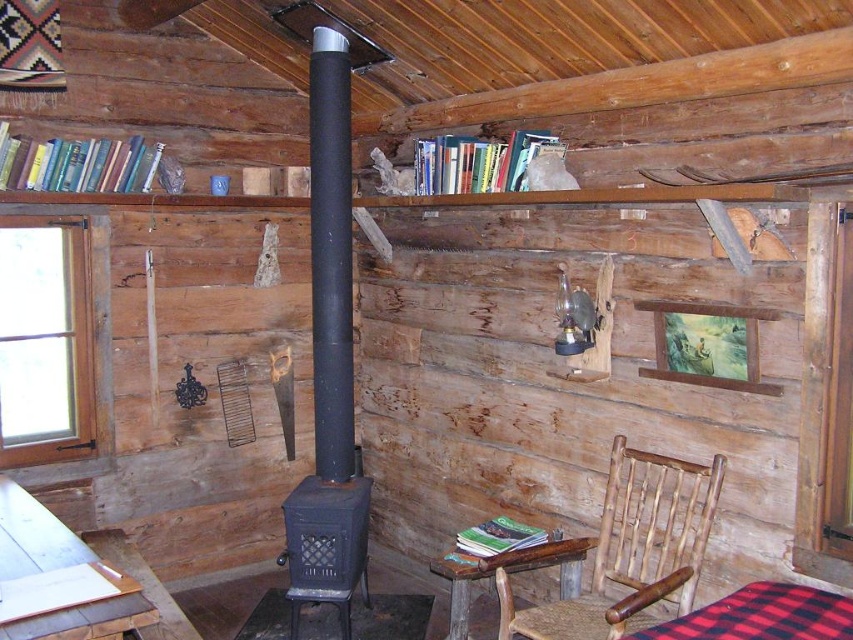
In the scene shown: Can you confirm if red plaid fabric at lower right is bigger than rustic wood table at lower center?

Incorrect, red plaid fabric at lower right is not larger than rustic wood table at lower center.

Does red plaid fabric at lower right appear on the right side of rustic wood table at lower center?

Correct, you'll find red plaid fabric at lower right to the right of rustic wood table at lower center.

Who is more forward, (628, 637) or (584, 540)?

Point (628, 637) is in front.

You are a GUI agent. You are given a task and a screenshot of the screen. Output one action in this format:
    pyautogui.click(x=<x>, y=<y>)
    Task: Click on the red plaid fabric at lower right
    Image resolution: width=853 pixels, height=640 pixels.
    Given the screenshot: What is the action you would take?
    pyautogui.click(x=762, y=616)

Which is in front, point (621, 628) or point (746, 634)?

Point (746, 634) is more forward.

Can you confirm if woven wood chair at lower right is bigger than red plaid fabric at lower right?

Correct, woven wood chair at lower right is larger in size than red plaid fabric at lower right.

The width and height of the screenshot is (853, 640). Find the location of `woven wood chair at lower right`. woven wood chair at lower right is located at coordinates (624, 550).

Does woven wood chair at lower right have a lesser height compared to rustic wood table at lower center?

In fact, woven wood chair at lower right may be taller than rustic wood table at lower center.

Measure the distance between woven wood chair at lower right and rustic wood table at lower center.

They are 8.87 inches apart.

The height and width of the screenshot is (640, 853). I want to click on woven wood chair at lower right, so click(624, 550).